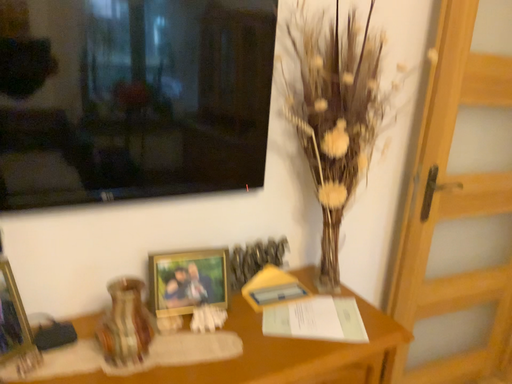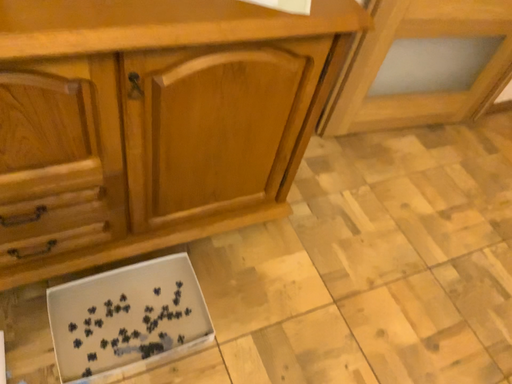
Question: Which way did the camera rotate in the video?

Choices:
 (A) rotated upward
 (B) rotated downward

Answer: (B)